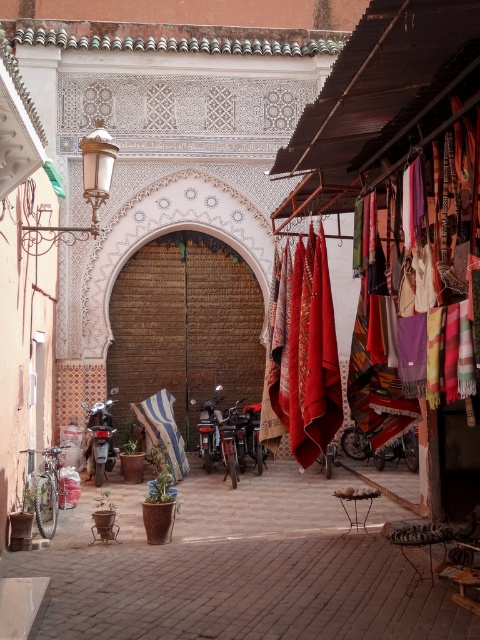
Question: Is textured woolen scarves at center positioned before blue striped fabric at center?

Choices:
 (A) no
 (B) yes

Answer: (B)

Question: Is blue striped fabric at center thinner than shiny metallic motorcycle at center?

Choices:
 (A) no
 (B) yes

Answer: (A)

Question: Which object appears farthest from the camera in this image?

Choices:
 (A) shiny metallic motorcycle at center
 (B) blue striped fabric at center

Answer: (B)

Question: Among these objects, which one is nearest to the camera?

Choices:
 (A) textured woolen scarves at center
 (B) blue striped fabric at center
 (C) shiny metallic motorcycle at center

Answer: (A)

Question: Which point is closer to the camera?

Choices:
 (A) textured woolen scarves at center
 (B) shiny metallic motorcycle at center
 (C) blue striped fabric at center

Answer: (A)

Question: From the image, what is the correct spatial relationship of textured woolen scarves at center in relation to blue striped fabric at center?

Choices:
 (A) left
 (B) right

Answer: (B)